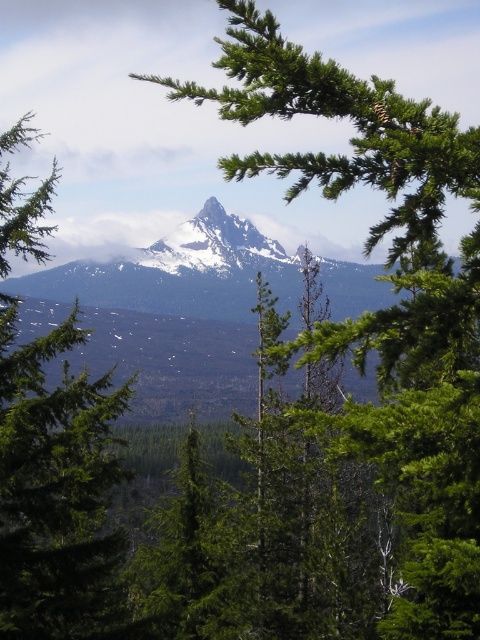
Question: Which object is positioned farthest from the green leafy branch at center?

Choices:
 (A) snowy rock mountain at center
 (B) white snow-covered peak at center

Answer: (B)

Question: Which point is closer to the camera taking this photo?

Choices:
 (A) (105, 458)
 (B) (444, 300)
 (C) (227, 248)
 (D) (210, 252)

Answer: (B)

Question: Where is green matte tree at center located in relation to white snow-covered peak at center in the image?

Choices:
 (A) above
 (B) below

Answer: (B)

Question: Which object appears closest to the camera in this image?

Choices:
 (A) white snow-covered peak at center
 (B) green leafy branch at center
 (C) snowy rock mountain at center

Answer: (B)

Question: Where is green leafy branch at center located in relation to snowy rock mountain at center in the image?

Choices:
 (A) above
 (B) below

Answer: (A)

Question: In this image, where is green leafy branch at center located relative to snowy rock mountain at center?

Choices:
 (A) above
 (B) below

Answer: (A)